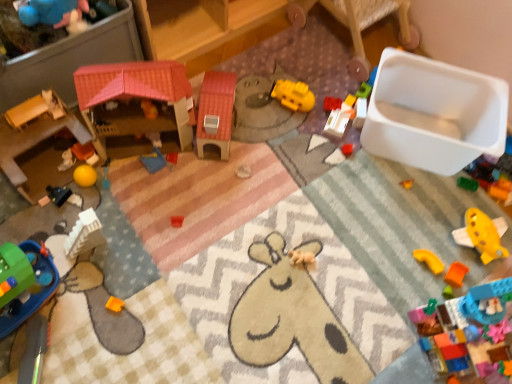
Locate an element on the screen. This screenshot has width=512, height=384. vacant position to the left of yellow plastic airplane at lower right, arranged as the 15th toy when viewed from the left is located at coordinates (417, 237).